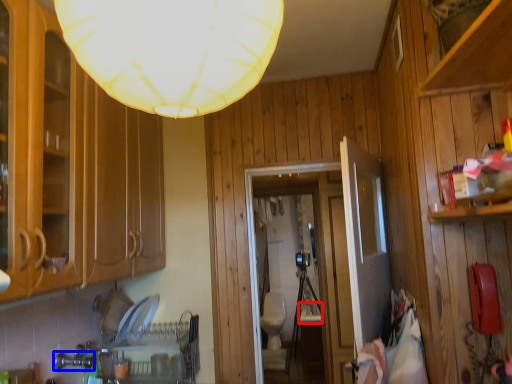
Question: Among these objects, which one is farthest to the camera, sink (highlighted by a red box) or faucet (highlighted by a blue box)?

Choices:
 (A) sink
 (B) faucet

Answer: (A)